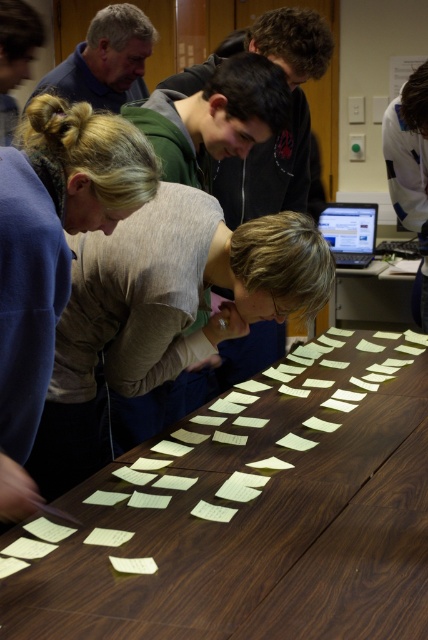
You are standing at the entrance of the room where the brown wood table at center is located. If you face the table, which direction would you be facing relative to the entrance?

The position of the brown wood table at center is at point (256,538), so you would be facing north relative to the entrance.

You are a new member joining the group at the table. To get a better view of the brown wood table at center, should you move towards or away from the blonde hair at upper left?

The brown wood table at center is in front of blonde hair at upper left, so to get a better view of the table, you should move towards the blonde hair at upper left.